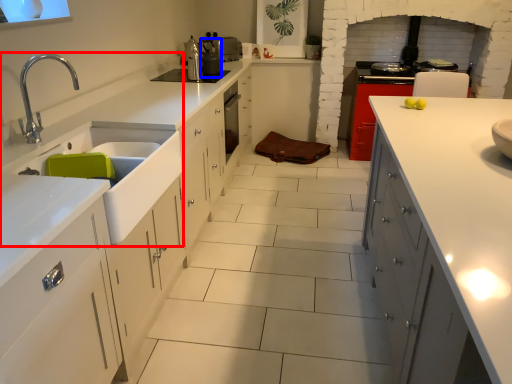
Question: Which point is further to the camera, sink (highlighted by a red box) or appliance (highlighted by a blue box)?

Choices:
 (A) sink
 (B) appliance

Answer: (B)